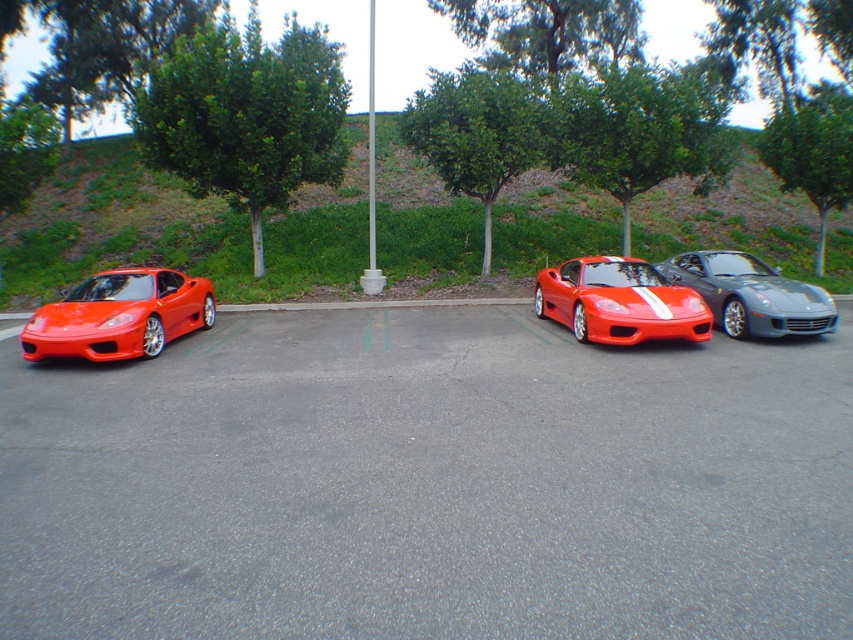
The height and width of the screenshot is (640, 853). What do you see at coordinates (619, 301) in the screenshot?
I see `shiny red sports car at center` at bounding box center [619, 301].

Which of these two, shiny red sports car at center or shiny metallic sports car at center right, stands shorter?

With less height is shiny metallic sports car at center right.

Which is in front, point (552, 280) or point (740, 252)?

Point (552, 280) is in front.

The width and height of the screenshot is (853, 640). What are the coordinates of `shiny red sports car at center` in the screenshot? It's located at (619, 301).

Is glossy red sports car at left below shiny red sports car at center?

No.

Image resolution: width=853 pixels, height=640 pixels. Describe the element at coordinates (119, 316) in the screenshot. I see `glossy red sports car at left` at that location.

At what (x,y) coordinates should I click in order to perform the action: click on glossy red sports car at left. Please return your answer as a coordinate pair (x, y). Image resolution: width=853 pixels, height=640 pixels. Looking at the image, I should click on (119, 316).

Is glossy red sports car at left bigger than shiny metallic sports car at center right?

Yes, glossy red sports car at left is bigger than shiny metallic sports car at center right.

Does point (105, 298) come in front of point (804, 284)?

Yes, point (105, 298) is in front of point (804, 284).

Which is behind, point (166, 276) or point (730, 253)?

Point (730, 253)

The width and height of the screenshot is (853, 640). What are the coordinates of `glossy red sports car at left` in the screenshot? It's located at (119, 316).